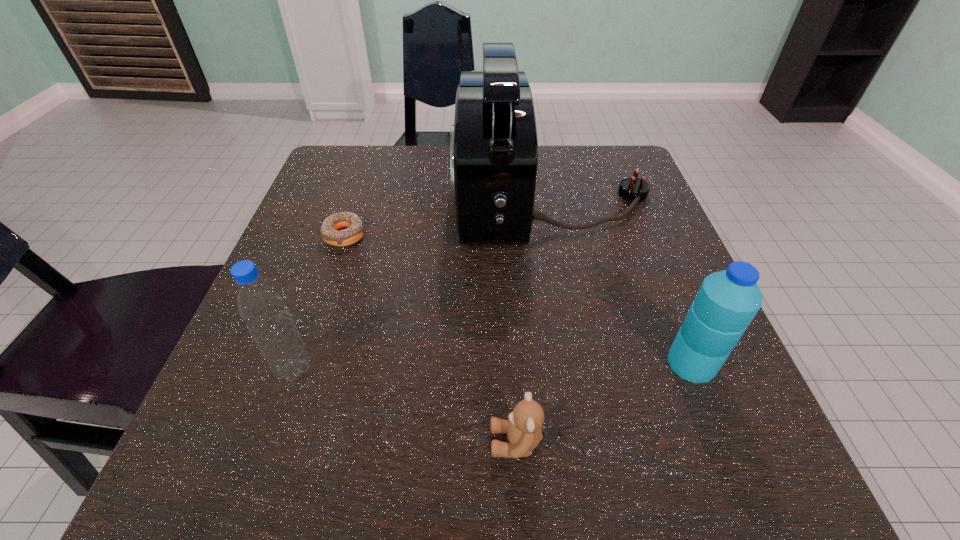
Identify the location of free space between the nearest object and the left water bottle. Image resolution: width=960 pixels, height=540 pixels. (405, 406).

Where is `free space between the left water bottle and the doughnut`? free space between the left water bottle and the doughnut is located at coordinates (320, 302).

Locate an element on the screen. This screenshot has height=540, width=960. free space between the tallest object and the left water bottle is located at coordinates (422, 283).

This screenshot has height=540, width=960. Find the location of `vacant area that lies between the nearest object and the right water bottle`. vacant area that lies between the nearest object and the right water bottle is located at coordinates (604, 402).

Identify the location of empty location between the doughnut and the right water bottle. The image size is (960, 540). coord(518,299).

Locate an element on the screen. Image resolution: width=960 pixels, height=540 pixels. vacant point located between the left water bottle and the doughnut is located at coordinates (320, 302).

The image size is (960, 540). Find the location of `unoccupied area between the teddy bear and the right water bottle`. unoccupied area between the teddy bear and the right water bottle is located at coordinates (604, 402).

Identify the location of empty location between the radio receiver and the teddy bear. (534, 320).

This screenshot has width=960, height=540. Find the location of `unoccupied position between the left water bottle and the right water bottle`. unoccupied position between the left water bottle and the right water bottle is located at coordinates (492, 366).

Locate which object ranks in proximity to the doughnut. Please provide its 2D coordinates. Your answer should be formatted as a tuple, i.e. [(x, y)], where the tuple contains the x and y coordinates of a point satisfying the conditions above.

[(493, 144)]